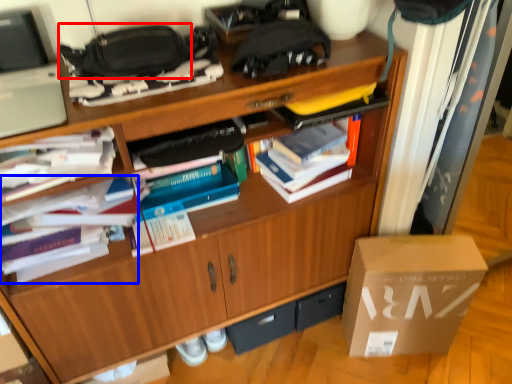
Question: Among these objects, which one is farthest to the camera, handbag (highlighted by a red box) or book (highlighted by a blue box)?

Choices:
 (A) handbag
 (B) book

Answer: (B)